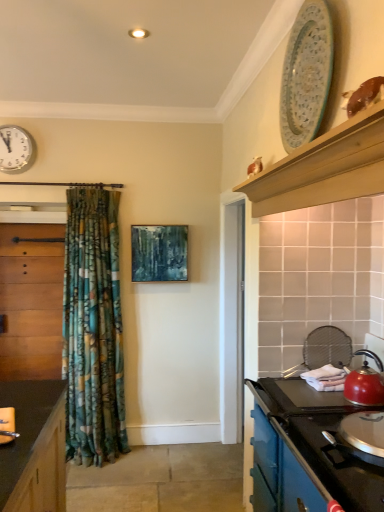
Find the location of a particular element. Image resolution: width=384 pixels, height=512 pixels. empty space that is ontop of wooden cabinet at left, which is the first cabinetry in left-to-right order (from a real-world perspective) is located at coordinates (27, 224).